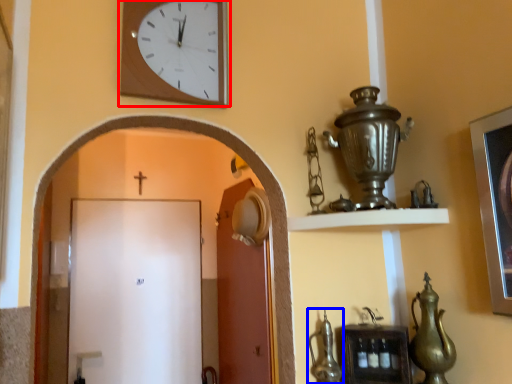
Question: Which of the following is the closest to the observer, wall clock (highlighted by a red box) or tea pot (highlighted by a blue box)?

Choices:
 (A) wall clock
 (B) tea pot

Answer: (A)